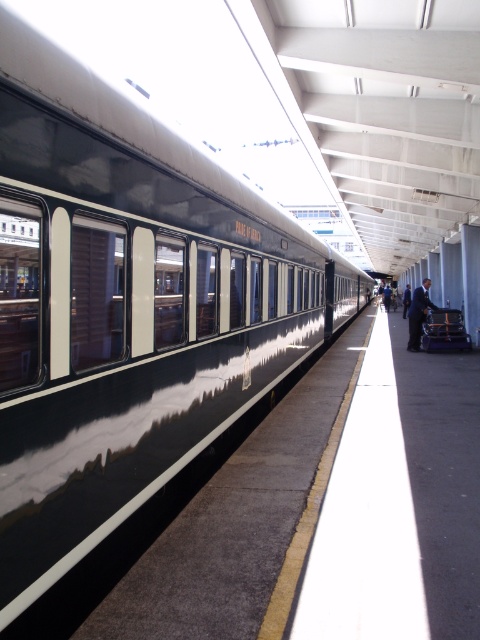
Question: Can you confirm if dark blue suit at right is positioned above dark blue suit at platform right?

Choices:
 (A) no
 (B) yes

Answer: (A)

Question: Which point is farther from the camera taking this photo?

Choices:
 (A) (407, 300)
 (B) (415, 346)

Answer: (A)

Question: Which point appears farthest from the camera in this image?

Choices:
 (A) (384, 301)
 (B) (420, 317)

Answer: (A)

Question: Is dark blue suit at right positioned in front of dark blue suit at platform right?

Choices:
 (A) yes
 (B) no

Answer: (A)

Question: Estimate the real-world distances between objects in this image. Which object is closer to the dark blue suit at right?

Choices:
 (A) black suit at right
 (B) dark blue suit at platform right

Answer: (B)

Question: From the image, what is the correct spatial relationship of dark blue suit at right in relation to dark blue suit at platform right?

Choices:
 (A) above
 (B) below

Answer: (B)